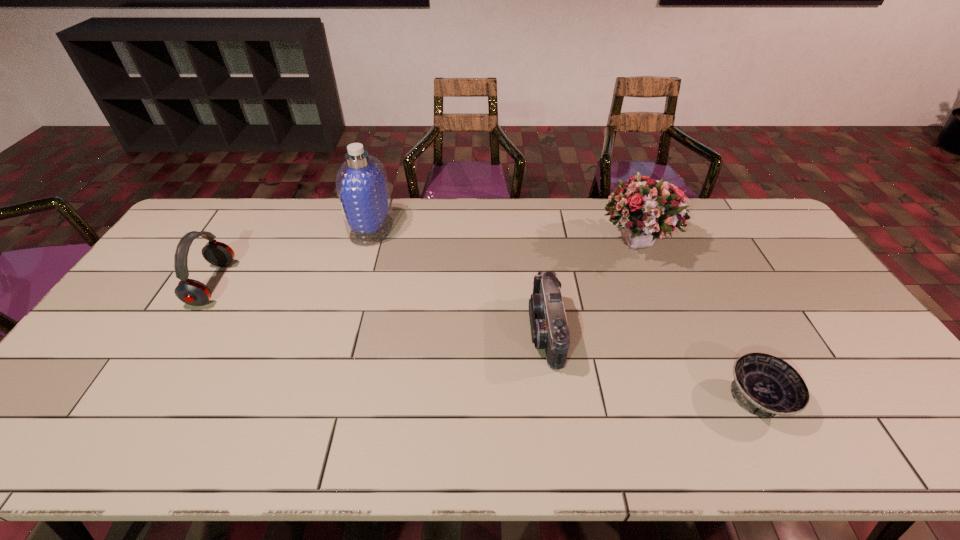
Find the location of a particular element. vacant area at the left edge is located at coordinates (72, 384).

Where is `free region at the right edge of the desktop`? free region at the right edge of the desktop is located at coordinates (865, 366).

Identify the location of blank space at the far left corner. Image resolution: width=960 pixels, height=540 pixels. (207, 211).

Where is `free spot at the far right corner of the desktop`? Image resolution: width=960 pixels, height=540 pixels. free spot at the far right corner of the desktop is located at coordinates (728, 212).

Locate an element on the screen. Image resolution: width=960 pixels, height=540 pixels. empty location between the second tallest object and the third object from right to left is located at coordinates click(x=592, y=287).

At what (x,y) coordinates should I click in order to perform the action: click on free space between the fourth object from right to left and the bouquet. Please return your answer as a coordinate pair (x, y). This screenshot has width=960, height=540. Looking at the image, I should click on (505, 236).

The image size is (960, 540). What are the coordinates of `empty space that is in between the camcorder and the bowl` in the screenshot? It's located at (652, 365).

Where is `unoccupied position between the bouquet and the cleansing agent`? Image resolution: width=960 pixels, height=540 pixels. unoccupied position between the bouquet and the cleansing agent is located at coordinates (505, 236).

Locate an element on the screen. unoccupied area between the second object from left to right and the fourth tallest object is located at coordinates (459, 280).

This screenshot has height=540, width=960. Find the location of `free space between the third object from right to left and the fourth shortest object`. free space between the third object from right to left and the fourth shortest object is located at coordinates (592, 287).